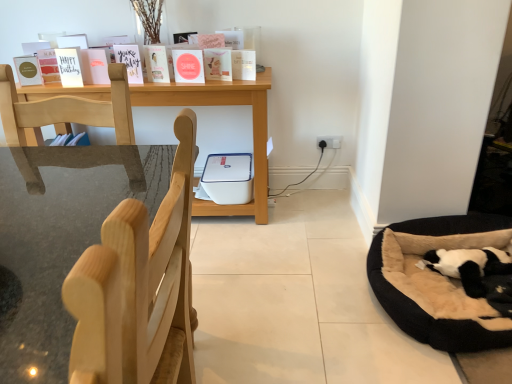
Question: From the image's perspective, is white matte card at upper left, which is the 7th paperback book from right to left, positioned above or below black plush dog bed at lower right?

Choices:
 (A) above
 (B) below

Answer: (A)

Question: Is point (77, 79) closer or farther from the camera than point (457, 248)?

Choices:
 (A) farther
 (B) closer

Answer: (A)

Question: Considering the real-world distances, which object is closest to the matte pink card at upper left, marked as the 3th paperback book in a left-to-right arrangement?

Choices:
 (A) white matte card at upper left, which is the 7th paperback book from right to left
 (B) black plush dog bed at lower right
 (C) matte white greeting cards at upper left
 (D) matte pink card at center, the 6th paperback book when ordered from left to right
 (E) light wood chair at left

Answer: (A)

Question: Which object is positioned closest to the matte pink card at center, the third paperback book from the right?

Choices:
 (A) white matte paperback book at upper center, positioned as the 8th paperback book in left-to-right order
 (B) matte pink card at upper left, acting as the 6th paperback book starting from the right
 (C) matte white greeting cards at upper left
 (D) matte green paperback book at left, the 1th paperback book viewed from the left
 (E) matte white paperback book at center, positioned as the fifth paperback book in left-to-right order

Answer: (E)